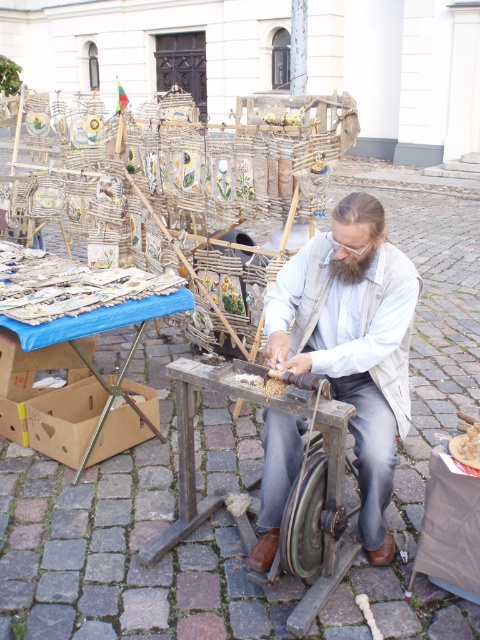
Consider the image. Who is positioned more to the right, white cotton shirt at center or green rubber wheel at center?

Positioned to the right is white cotton shirt at center.

Which is above, white cotton shirt at center or green rubber wheel at center?

white cotton shirt at center is above.

Which is behind, point (282, 419) or point (282, 518)?

Point (282, 419)

The image size is (480, 640). What are the coordinates of `white cotton shirt at center` in the screenshot? It's located at (352, 340).